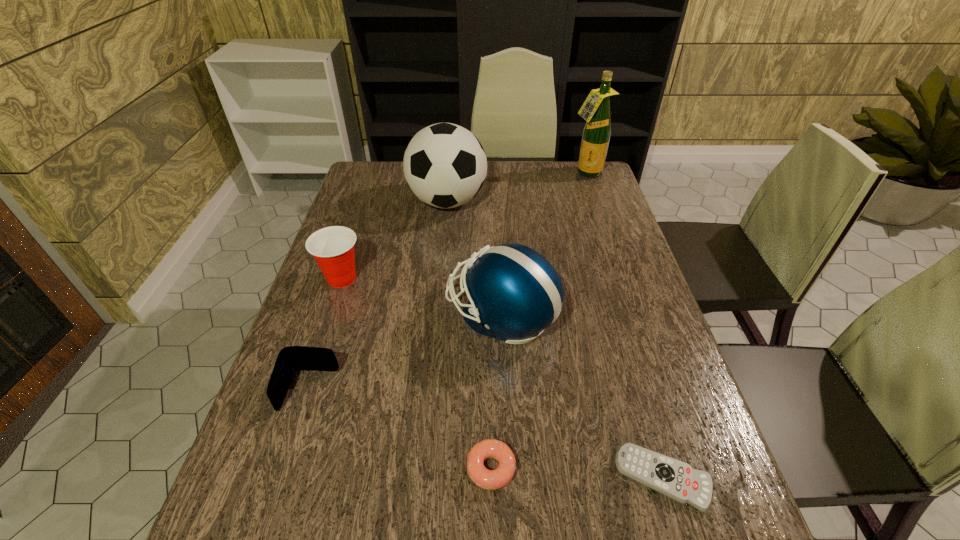
Locate an element on the screen. unoccupied area between the cup and the second shortest object is located at coordinates (417, 373).

At what (x,y) coordinates should I click in order to perform the action: click on vacant area that lies between the remote control and the liquor. Please return your answer as a coordinate pair (x, y). The height and width of the screenshot is (540, 960). Looking at the image, I should click on (625, 326).

This screenshot has width=960, height=540. Identify the location of unoccupied area between the remote control and the cup. (502, 378).

The width and height of the screenshot is (960, 540). What are the coordinates of `vacant area that lies between the shortest object and the liquor` in the screenshot? It's located at (625, 326).

I want to click on empty space that is in between the third shortest object and the soccer ball, so click(x=378, y=296).

Find the location of `vacant point located between the liquor and the fifth shortest object`. vacant point located between the liquor and the fifth shortest object is located at coordinates (543, 244).

The image size is (960, 540). What are the coordinates of `vacant area that lies between the third tallest object and the wallet` in the screenshot? It's located at pos(405,353).

Locate an element on the screen. This screenshot has width=960, height=540. free space between the doughnut and the shortest object is located at coordinates (577, 473).

The width and height of the screenshot is (960, 540). Identify the location of free space that is in between the football helmet and the doughnut. (496, 392).

This screenshot has width=960, height=540. I want to click on object that is the third closest to the third nearest object, so click(489, 448).